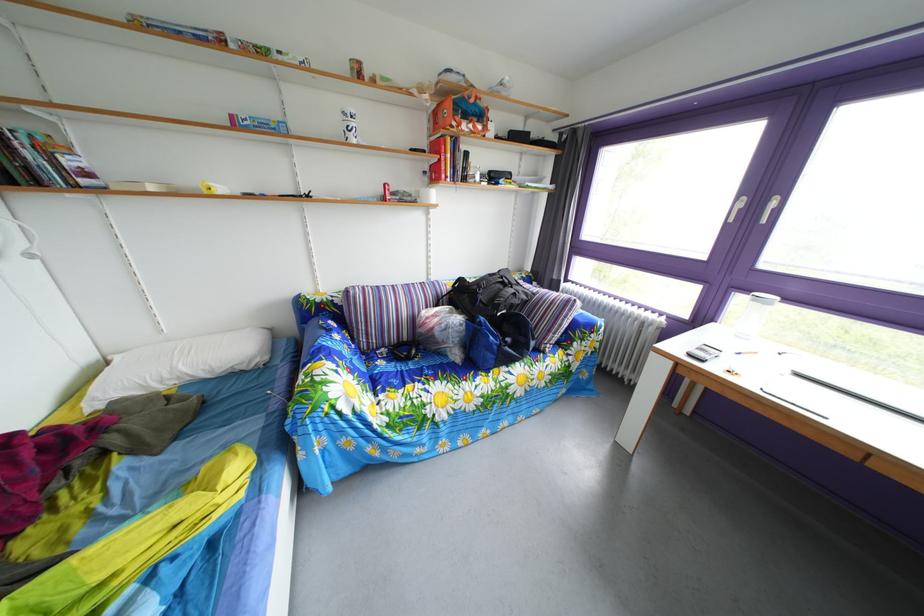
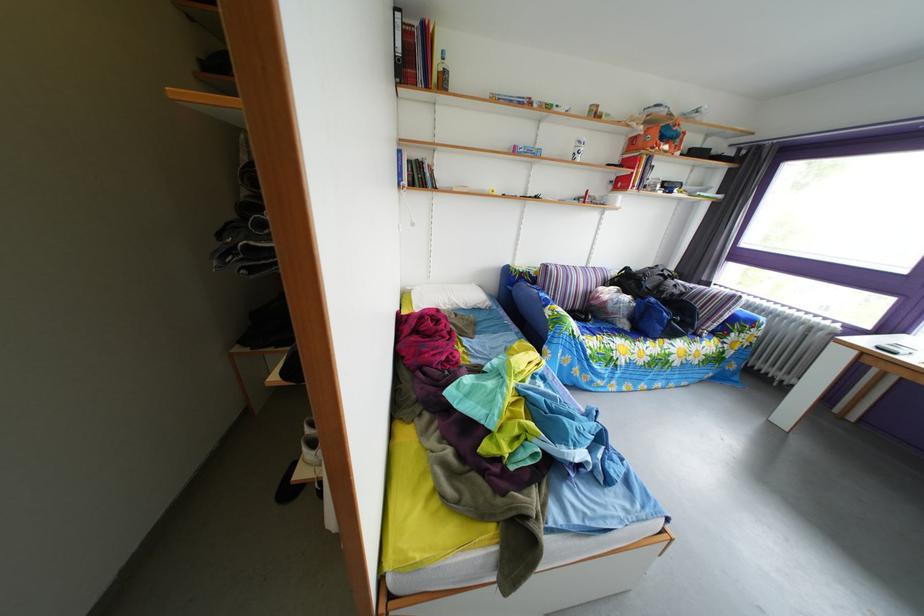
Question: I am providing you with two images of the same scene from different viewpoints. Which of the following objects are not visible in image2?

Choices:
 (A) white pillow
 (B) white cup
 (C) blue bag
 (D) none of these

Answer: (D)